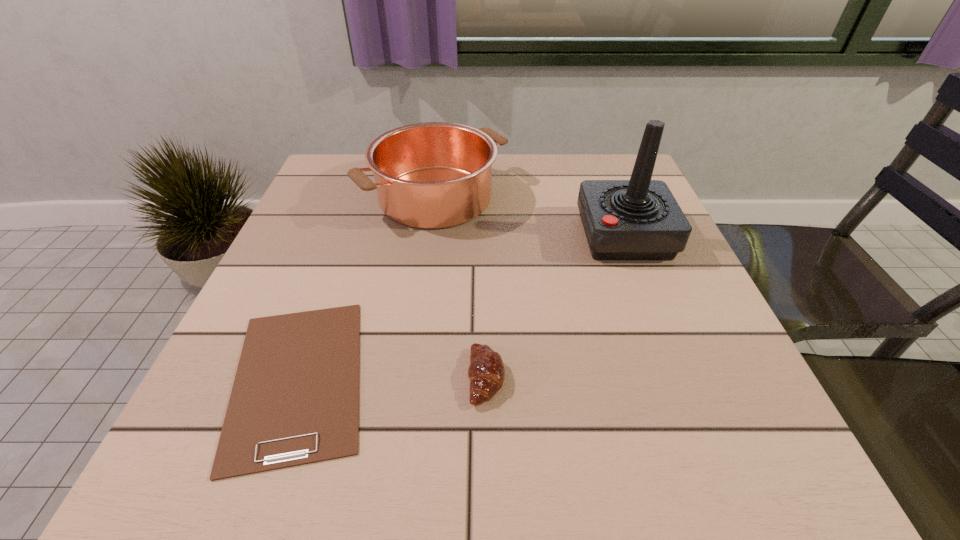
The width and height of the screenshot is (960, 540). What are the coordinates of `vacant region at the far right corner of the desktop` in the screenshot? It's located at (608, 157).

The width and height of the screenshot is (960, 540). In order to click on free space between the second tallest object and the shortest object in this screenshot , I will do `click(367, 288)`.

What are the coordinates of `vacant space in between the saucepan and the third tallest object` in the screenshot? It's located at (461, 287).

At what (x,y) coordinates should I click in order to perform the action: click on vacant space that's between the second shortest object and the clipboard. Please return your answer as a coordinate pair (x, y). This screenshot has height=540, width=960. Looking at the image, I should click on (392, 378).

Locate an element on the screen. vacant area that lies between the saucepan and the second shortest object is located at coordinates (461, 287).

At what (x,y) coordinates should I click in order to perform the action: click on free space that is in between the shortest object and the rightmost object. Please return your answer as a coordinate pair (x, y). This screenshot has width=960, height=540. Looking at the image, I should click on (461, 307).

At what (x,y) coordinates should I click in order to perform the action: click on empty space that is in between the third tallest object and the tallest object. Please return your answer as a coordinate pair (x, y). Image resolution: width=960 pixels, height=540 pixels. Looking at the image, I should click on (555, 306).

The image size is (960, 540). What are the coordinates of `vacant area that lies between the third tallest object and the rightmost object` in the screenshot? It's located at (555, 306).

The image size is (960, 540). In order to click on free space between the saucepan and the shortest object in this screenshot , I will do `click(367, 288)`.

The width and height of the screenshot is (960, 540). I want to click on vacant region between the shortest object and the crescent roll, so click(x=392, y=378).